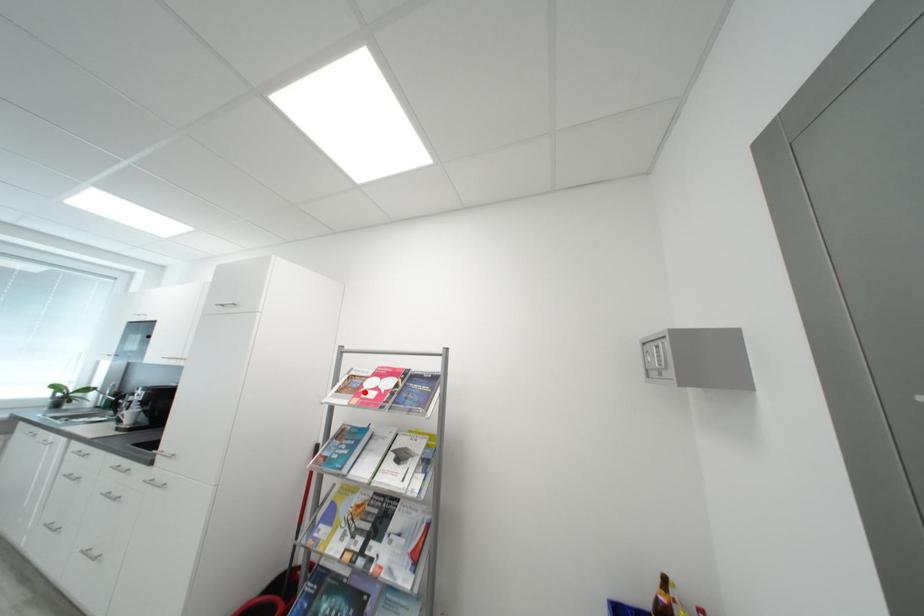
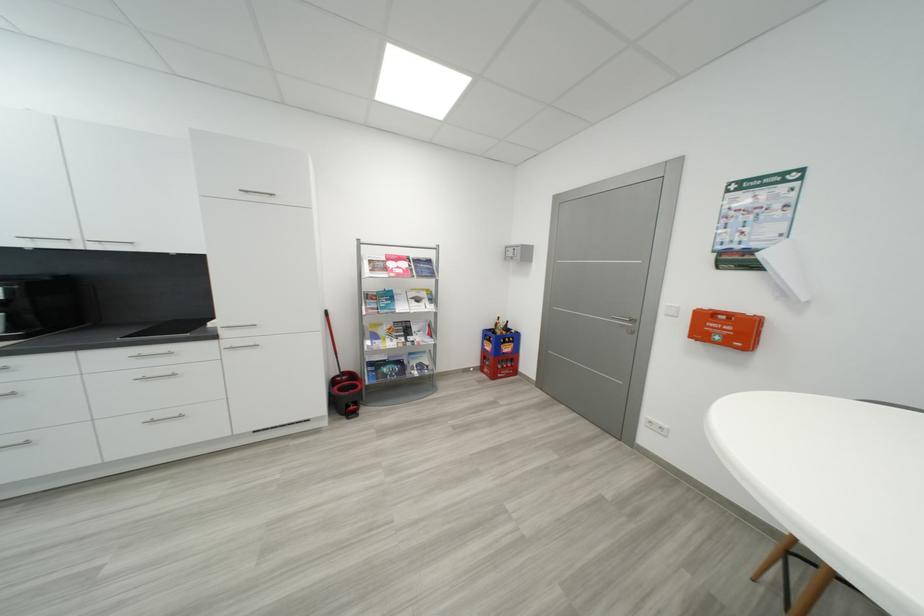
Question: I am providing you with two images of the same scene from different viewpoints. A red point is shown in image1. For the corresponding object point in image2, is it positioned nearer or farther from the camera?

Choices:
 (A) Nearer
 (B) Farther

Answer: (A)